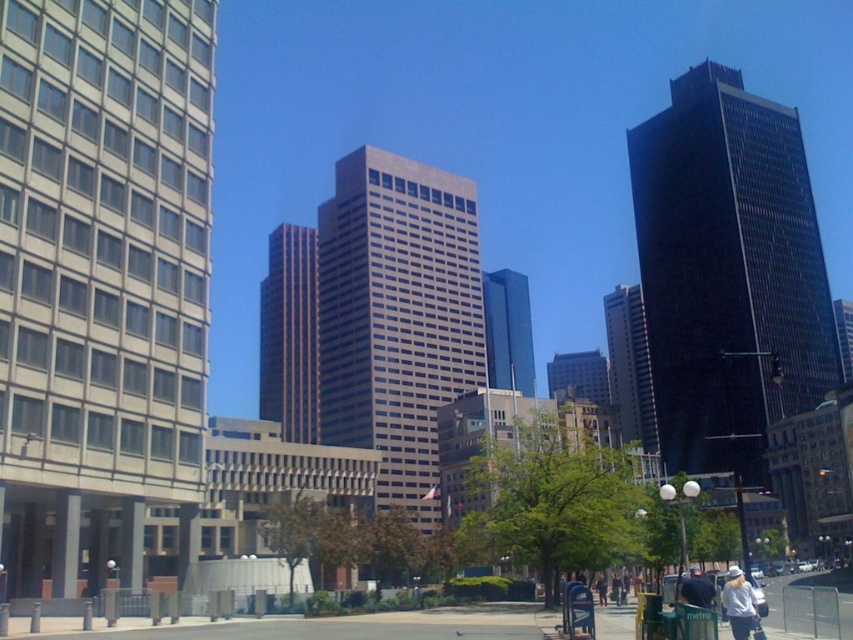
You are standing in the plaza and want to place your white cotton shirt at lower right on the gray concrete pavement at lower center. Can you fit the shirt entirely on the pavement without folding it?

The gray concrete pavement at lower center has a larger size compared to white cotton shirt at lower right, so yes, the shirt can be placed entirely on the pavement without folding.

You are standing in the plaza and want to take a photo of the white cotton shirt at lower right. However, the gray concrete pavement at lower center is blocking your view. Can you move to the left to get a clear shot?

The white cotton shirt at lower right is behind the gray concrete pavement at lower center, so moving to the left might not help. You need to move around to a position where the white cotton shirt at lower right is no longer obscured by the gray concrete pavement at lower center.

You are standing in the plaza and notice the gray concrete pavement at lower center and the white cotton shirt at lower right. Which object is closer to the ground?

The gray concrete pavement at lower center is closer to the ground because it is positioned below the white cotton shirt at lower right.